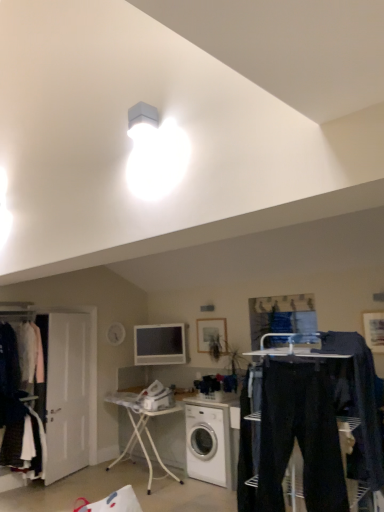
Question: Is white glossy washing machine at center bigger or smaller than dark blue jeans at center?

Choices:
 (A) big
 (B) small

Answer: (A)

Question: In terms of height, does white glossy washing machine at center look taller or shorter compared to dark blue jeans at center?

Choices:
 (A) tall
 (B) short

Answer: (B)

Question: Which of these objects is positioned closest to the dark blue jeans at center?

Choices:
 (A) wooden framed picture at right, the 1th picture frame when ordered from right to left
 (B) white metal ironing board at center
 (C) white glossy television at center
 (D) white matte door at left, the first closet positioned from the back
 (E) matte black clothes at left, the first closet in the front-to-back sequence

Answer: (A)

Question: Which of these objects is positioned farthest from the wooden framed picture at right, the 1th picture frame when ordered from right to left?

Choices:
 (A) matte wooden picture frame at center, the first picture frame viewed from the left
 (B) white metal ironing board at center
 (C) dark blue jeans at center
 (D) white glossy washing machine at center
 (E) white matte door at left, the first closet positioned from the back

Answer: (E)